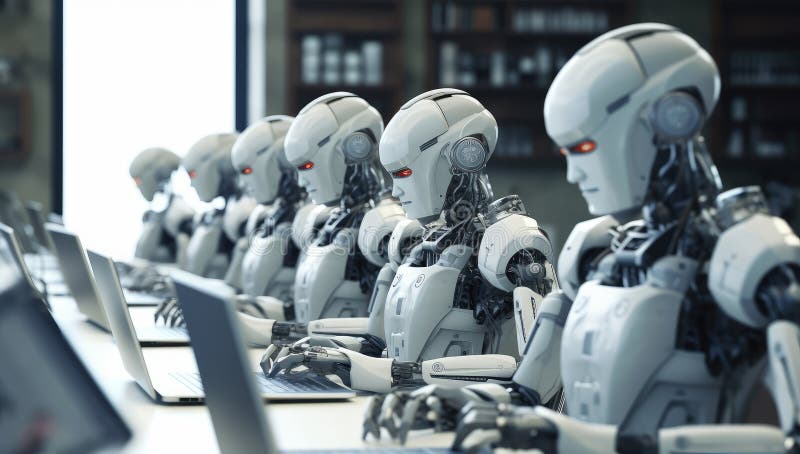
Where is `laptop computer`? Image resolution: width=800 pixels, height=454 pixels. laptop computer is located at coordinates (106, 287), (213, 312), (76, 256), (34, 215), (10, 238).